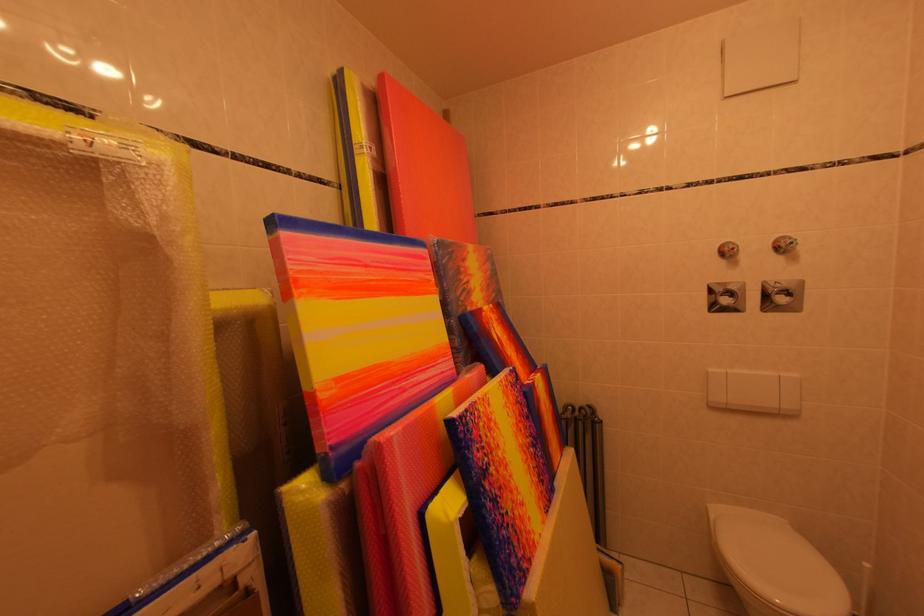
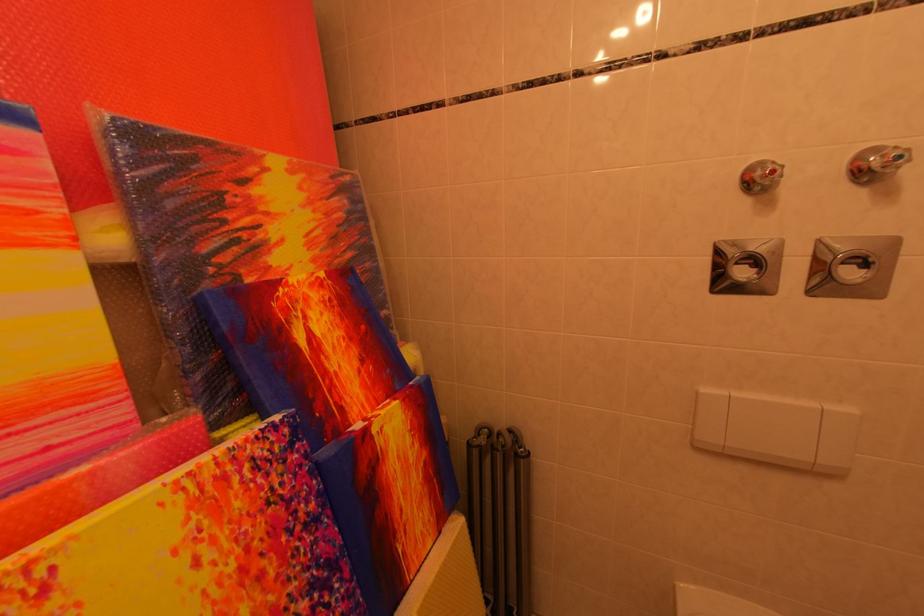
Find the pixel in the second image that matches (742,253) in the first image.

(782, 176)